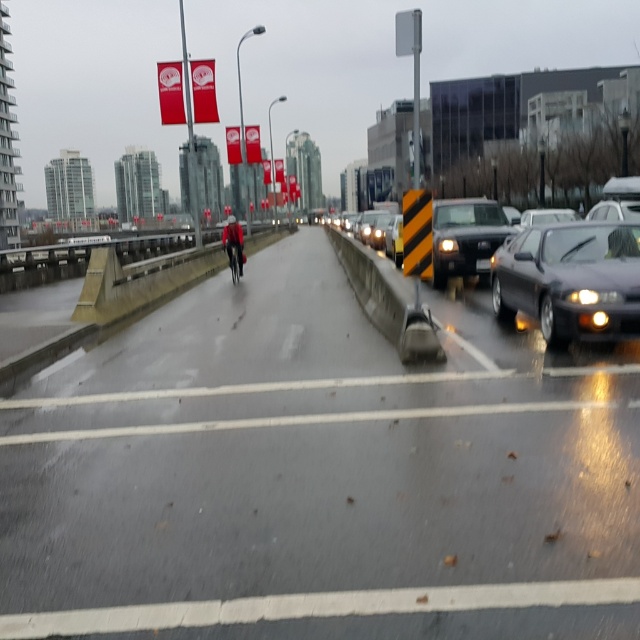
Question: Can you confirm if shiny black sedan at right is positioned to the left of shiny black car at right?

Choices:
 (A) no
 (B) yes

Answer: (A)

Question: Considering the real-world distances, which object is closest to the matte black suv at center?

Choices:
 (A) smooth asphalt highway at center
 (B) shiny metallic bicycle at center

Answer: (A)

Question: Does matte black suv at center lie behind shiny metallic bicycle at center?

Choices:
 (A) no
 (B) yes

Answer: (A)

Question: Which object appears closest to the camera in this image?

Choices:
 (A) shiny black sedan at right
 (B) shiny metallic bicycle at center
 (C) shiny black car at right

Answer: (C)

Question: Among these points, which one is nearest to the camera?

Choices:
 (A) (232, 252)
 (B) (630, 282)
 (C) (252, 621)

Answer: (C)

Question: In this image, where is smooth asphalt highway at center located relative to shiny black car at right?

Choices:
 (A) right
 (B) left

Answer: (B)